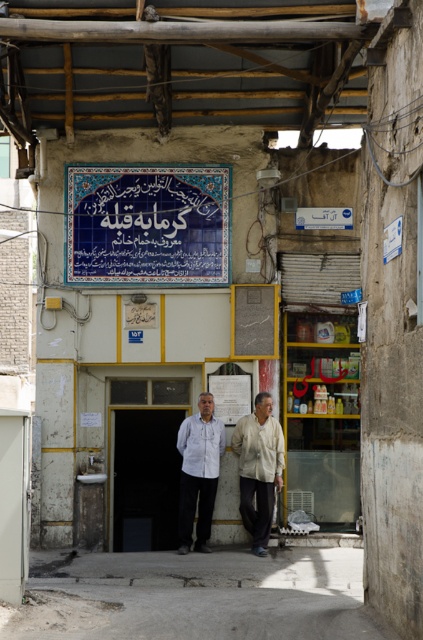
Is dark wood door at center smaller than light beige fabric shirt at center?

No.

Based on the photo, does dark wood door at center have a greater height compared to light beige fabric shirt at center?

No, dark wood door at center is not taller than light beige fabric shirt at center.

Is point (172, 512) closer to camera compared to point (255, 515)?

No, it is not.

Identify the location of dark wood door at center. Image resolution: width=423 pixels, height=640 pixels. (145, 477).

Does point (43, 572) come closer to viewer compared to point (184, 499)?

Yes, point (43, 572) is closer to viewer.

Which is above, dusty concrete alley at lower center or white cotton shirt at center?

white cotton shirt at center is above.

Who is more distant from viewer, (x=277, y=605) or (x=217, y=474)?

The point (x=217, y=474) is more distant.

Locate an element on the screen. The width and height of the screenshot is (423, 640). dusty concrete alley at lower center is located at coordinates (195, 596).

Between dusty concrete alley at lower center and dark wood door at center, which one is positioned higher?

Positioned higher is dark wood door at center.

Can you confirm if dusty concrete alley at lower center is positioned to the right of dark wood door at center?

Yes, dusty concrete alley at lower center is to the right of dark wood door at center.

Where is `dusty concrete alley at lower center`? This screenshot has height=640, width=423. dusty concrete alley at lower center is located at coordinates (195, 596).